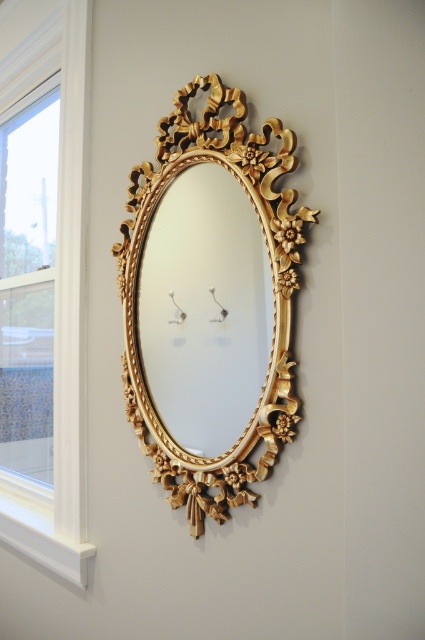
You are an interior designer assessing the placement of two gold ornate mirrors in a room. The scene shows a gold ornate mirror at upper center and a gold ornate mirror at center. Based on the spatial arrangement, which mirror is positioned closer to the viewer?

The gold ornate mirror at upper center is closer to the viewer because the gold ornate mirror at center is positioned behind it.

You are standing in a room and see the gold ornate mirror at upper center and the white wood window at left. Which object is positioned lower in the room?

The gold ornate mirror at upper center is positioned below the white wood window at left, so it is lower in the room.